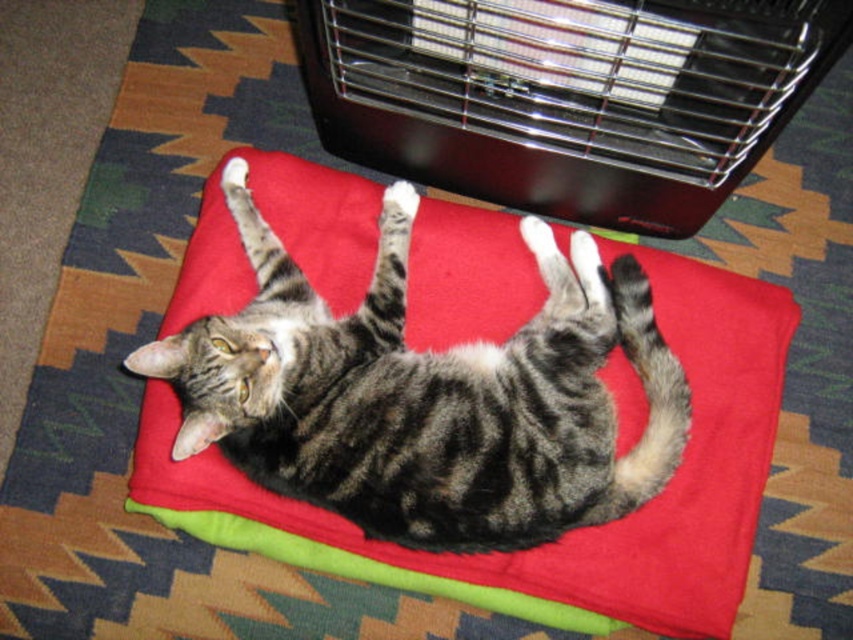
Can you confirm if tabby fur cat at center is wider than black metal heater at upper center?

Incorrect, tabby fur cat at center's width does not surpass black metal heater at upper center's.

Find the location of a particular element. The image size is (853, 640). tabby fur cat at center is located at coordinates (427, 394).